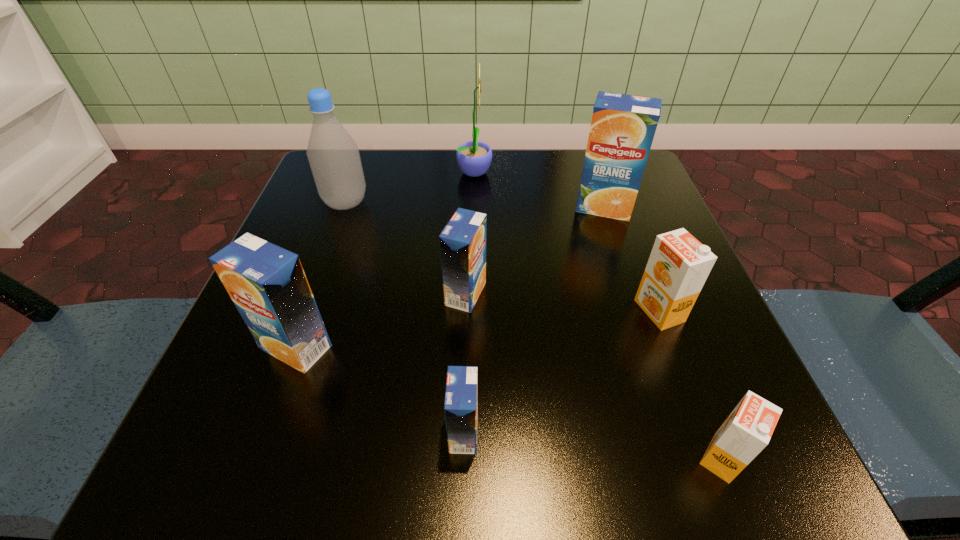
What are the coordinates of `the farthest object` in the screenshot? It's located at (x=474, y=158).

Find the location of `gray bottle`. gray bottle is located at coordinates (334, 158).

The width and height of the screenshot is (960, 540). Identify the location of the farthest orange juice. (622, 130).

This screenshot has width=960, height=540. I want to click on the rightmost blue orange_juice, so click(622, 130).

The height and width of the screenshot is (540, 960). In order to click on the leftmost orange juice in this screenshot , I will do `click(267, 283)`.

Where is `the second nearest blue orange_juice`? The image size is (960, 540). the second nearest blue orange_juice is located at coordinates (267, 283).

Find the location of a particular element. This screenshot has width=960, height=540. the farther orange orange juice is located at coordinates (678, 266).

Where is `the second smallest blue orange_juice`? The height and width of the screenshot is (540, 960). the second smallest blue orange_juice is located at coordinates (462, 242).

Where is `the smallest blue orange_juice`? the smallest blue orange_juice is located at coordinates (461, 398).

The height and width of the screenshot is (540, 960). I want to click on the smaller orange orange juice, so click(748, 429).